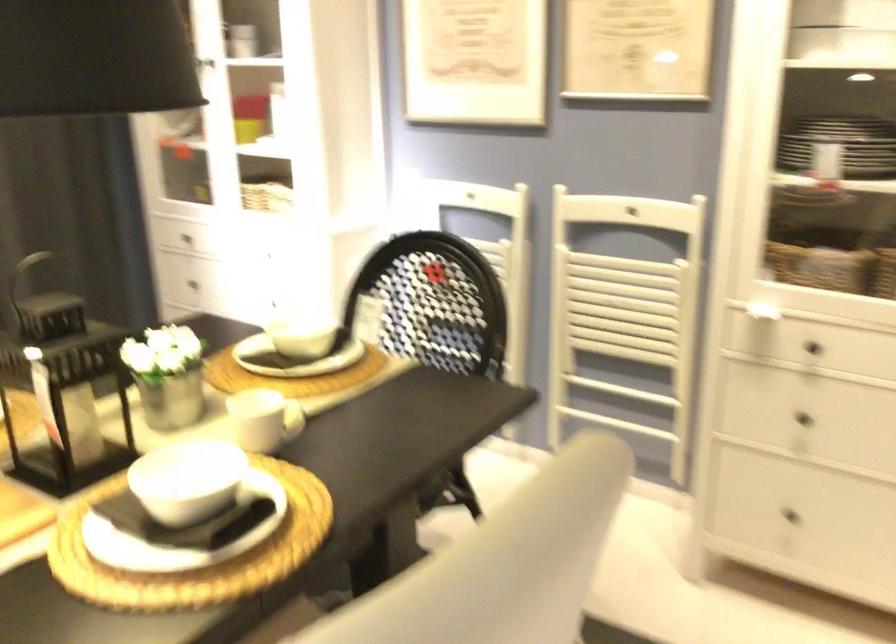
Find where to lift the black lantern handle. Please return your answer as a coordinate pair (x, y).

(47, 263)